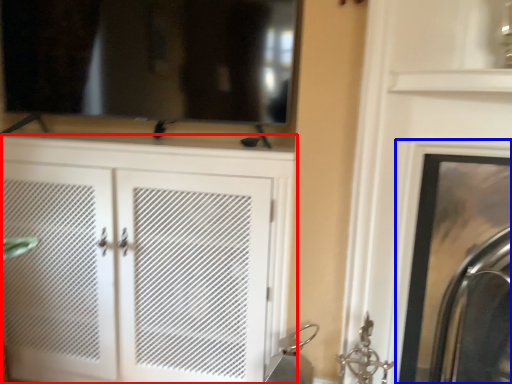
Question: Which of the following is the closest to the observer, cupboard (highlighted by a red box) or fireplace (highlighted by a blue box)?

Choices:
 (A) cupboard
 (B) fireplace

Answer: (B)